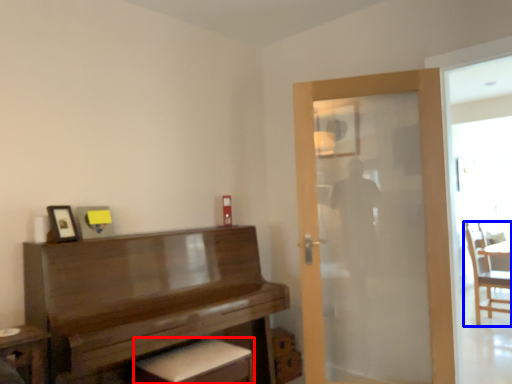
Question: Which object appears farthest to the camera in this image, footrest (highlighted by a red box) or chair (highlighted by a blue box)?

Choices:
 (A) footrest
 (B) chair

Answer: (B)